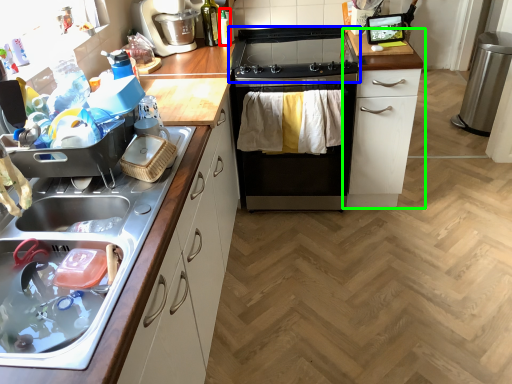
Question: Which object is the closest to the bottle (highlighted by a red box)? Choose among these: gas stove (highlighted by a blue box) or cabinetry (highlighted by a green box).

Choices:
 (A) gas stove
 (B) cabinetry

Answer: (A)